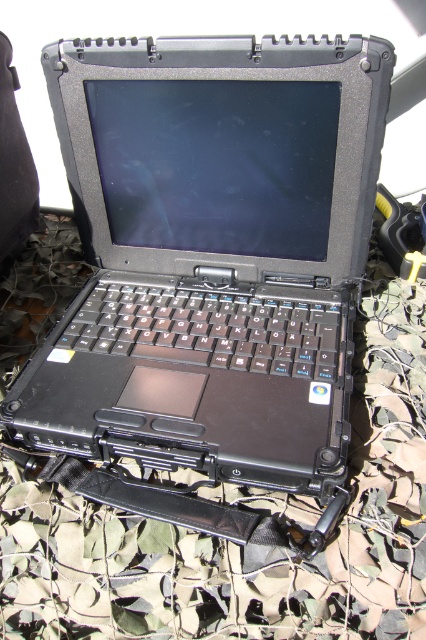
Question: Among these objects, which one is nearest to the camera?

Choices:
 (A) black matte laptop at center
 (B) camouflage fabric at center

Answer: (B)

Question: Is black matte laptop at center bigger than camouflage fabric at center?

Choices:
 (A) yes
 (B) no

Answer: (B)

Question: Can you confirm if black matte laptop at center is thinner than camouflage fabric at center?

Choices:
 (A) yes
 (B) no

Answer: (A)

Question: Which object appears closest to the camera in this image?

Choices:
 (A) black matte laptop at center
 (B) camouflage fabric at center

Answer: (B)

Question: Can you confirm if black matte laptop at center is thinner than camouflage fabric at center?

Choices:
 (A) no
 (B) yes

Answer: (B)